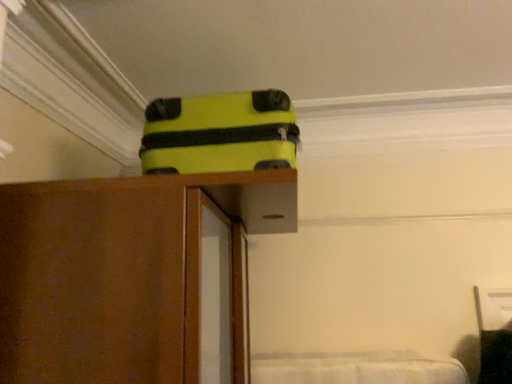
Identify the location of matte green suitcase at upper center. (219, 133).

The image size is (512, 384). Describe the element at coordinates (219, 133) in the screenshot. I see `matte green suitcase at upper center` at that location.

The width and height of the screenshot is (512, 384). Identify the location of matte green suitcase at upper center. (219, 133).